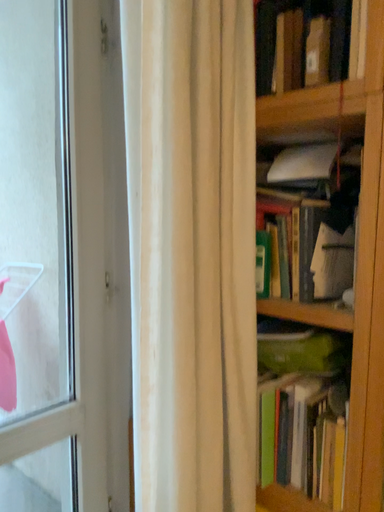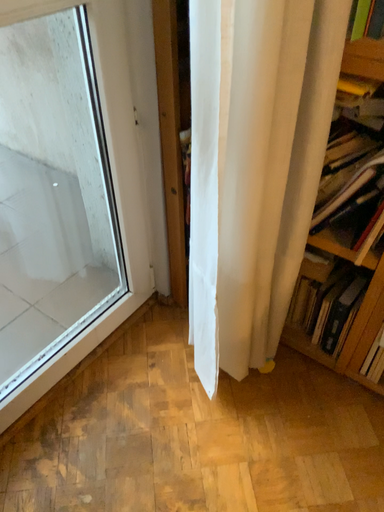
Question: How did the camera likely rotate when shooting the video?

Choices:
 (A) rotated upward
 (B) rotated downward

Answer: (B)